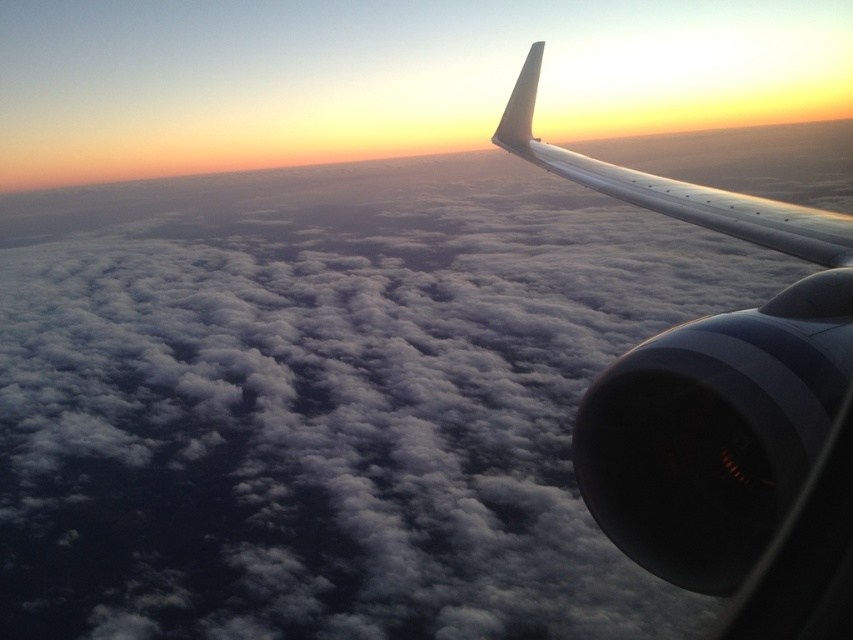
Question: Among these points, which one is nearest to the camera?

Choices:
 (A) pyautogui.click(x=808, y=493)
 (B) pyautogui.click(x=694, y=200)

Answer: (A)

Question: Can you confirm if metallic gray wing at upper right is smaller than sleek metallic wing at upper right?

Choices:
 (A) yes
 (B) no

Answer: (A)

Question: Observing the image, what is the correct spatial positioning of metallic gray wing at upper right in reference to sleek metallic wing at upper right?

Choices:
 (A) below
 (B) above

Answer: (A)

Question: Among these objects, which one is farthest from the camera?

Choices:
 (A) sleek metallic wing at upper right
 (B) metallic gray wing at upper right

Answer: (A)

Question: Is metallic gray wing at upper right to the right of sleek metallic wing at upper right from the viewer's perspective?

Choices:
 (A) yes
 (B) no

Answer: (B)